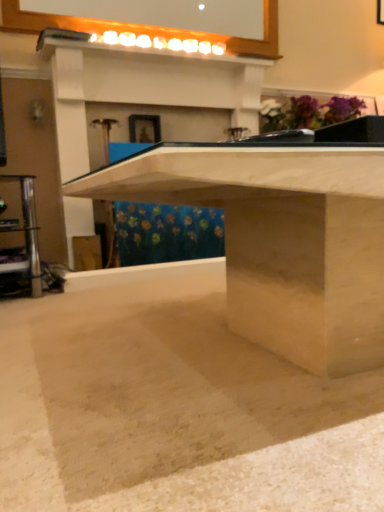
Question: Considering the positions of point (248, 391) and point (364, 212), is point (248, 391) closer or farther from the camera than point (364, 212)?

Choices:
 (A) farther
 (B) closer

Answer: (B)

Question: Is smooth concrete at center taller or shorter than sanded wood table at center?

Choices:
 (A) tall
 (B) short

Answer: (B)

Question: Which of these objects is positioned farthest from the sanded wood table at center?

Choices:
 (A) matte gold picture frame at upper center
 (B) smooth concrete at center

Answer: (A)

Question: Which object is positioned closest to the sanded wood table at center?

Choices:
 (A) smooth concrete at center
 (B) matte gold picture frame at upper center

Answer: (A)